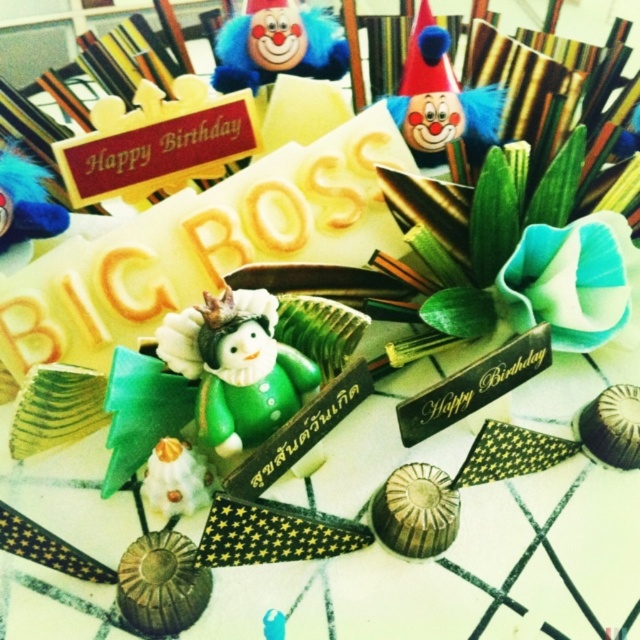
You are a guest at a birthday party and see the festive arrangement. There is a point marked at coordinates (442,100). What object is located at that point?

The point at coordinates (442,100) corresponds to the matte clown head at upper center.